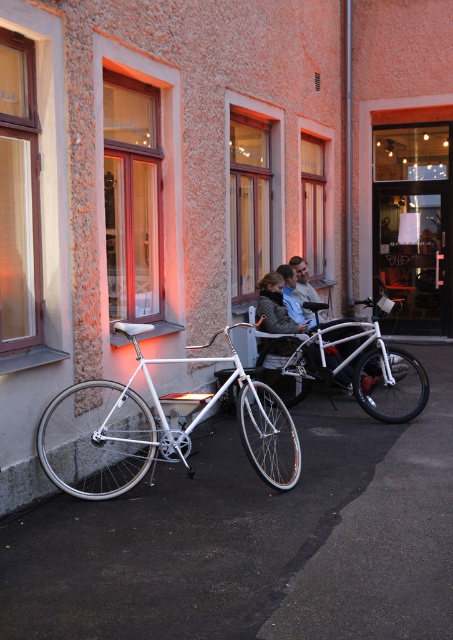
Can you confirm if white matte bicycle at center is positioned to the left of matte white bicycle at center?

Incorrect, white matte bicycle at center is not on the left side of matte white bicycle at center.

Describe the element at coordinates (386, 378) in the screenshot. The width and height of the screenshot is (453, 640). I see `white matte bicycle at center` at that location.

Is point (312, 348) positioned behind point (303, 278)?

No, it is not.

Identify the location of white matte bicycle at center. (386, 378).

Can you confirm if white metallic bicycle at left is smaller than white matte bicycle at center?

No, white metallic bicycle at left is not smaller than white matte bicycle at center.

Is point (278, 413) in front of point (311, 304)?

Yes, it is in front of point (311, 304).

Is point (120, 424) positioned in front of point (322, 368)?

Yes, point (120, 424) is closer to viewer.

You are a GUI agent. You are given a task and a screenshot of the screen. Output one action in this format:
    pyautogui.click(x=<x>, y=<y>)
    Task: Click on the white metallic bicycle at left
    
    Given the screenshot: What is the action you would take?
    pyautogui.click(x=106, y=435)

Does white metallic bicycle at left have a larger size compared to matte gray jacket at center?

Yes.

Between white metallic bicycle at left and matte gray jacket at center, which one has more height?

matte gray jacket at center is taller.

What are the coordinates of `white metallic bicycle at left` in the screenshot? It's located at (106, 435).

Where is `white metallic bicycle at left`? white metallic bicycle at left is located at coordinates (106, 435).